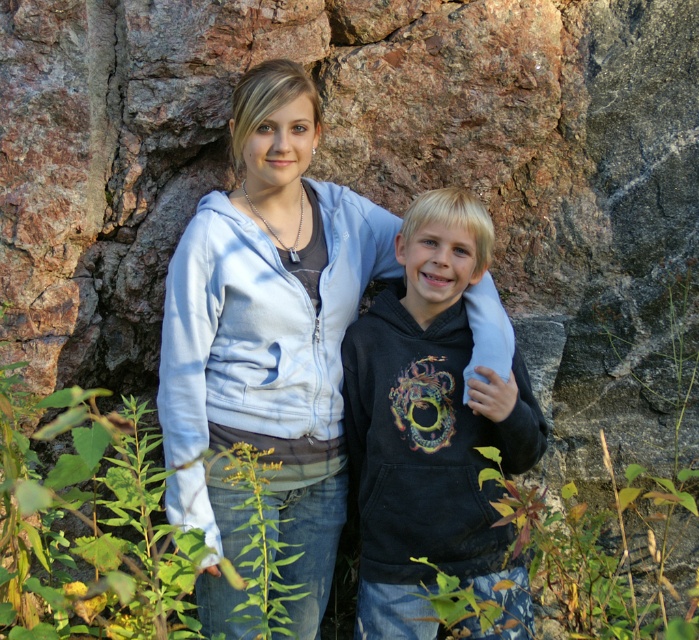
You are a photographer trying to capture the perfect shot of the light blue zip up hoodie at center. You know the hoodie is exactly at the point (273,317). If your camera has a rectangular viewfinder that covers an area from point 0.4 to 0.6 on the x axis and 0.35 to 0.45 on the y axis, will the hoodie be fully visible in the viewfinder?

The light blue zip up hoodie at center is located at point (273,317). The viewfinder covers x from 0.4 to 0.6 and y from 0.35 to 0.45. Since 0.498 is within 0.4 to 0.6 and 0.392 is within 0.35 to 0.45, the hoodie will be fully visible in the viewfinder.